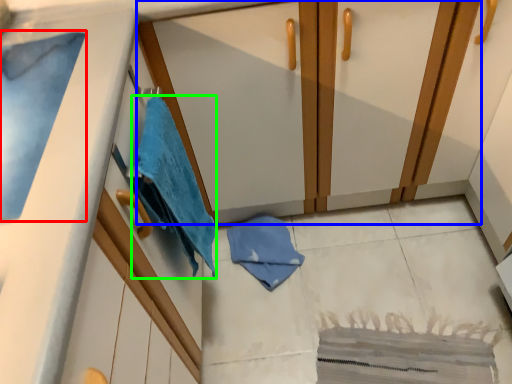
Question: Which object is positioned closest to bath towel (highlighted by a red box)? Select from dresser (highlighted by a blue box) and beach towel (highlighted by a green box).

Choices:
 (A) dresser
 (B) beach towel

Answer: (B)